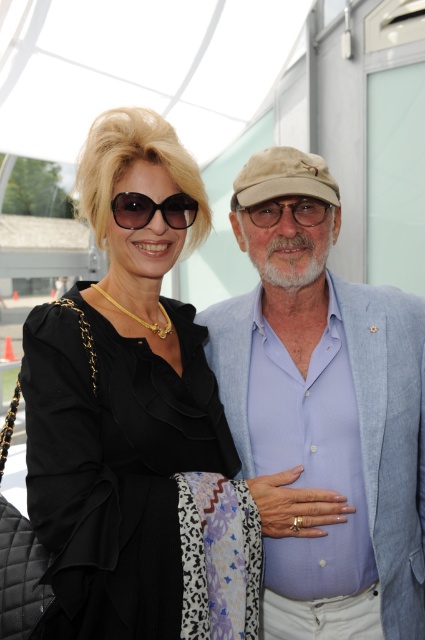
Can you confirm if black satin dress at center is positioned above light blue cotton shirt at center?

Correct, black satin dress at center is located above light blue cotton shirt at center.

Who is more distant from viewer, (102, 362) or (263, 266)?

The point (263, 266) is more distant.

This screenshot has width=425, height=640. What are the coordinates of `black satin dress at center` in the screenshot? It's located at (125, 410).

Is matte black sunglasses at upper left bigger than matte black glasses at center?

Yes, matte black sunglasses at upper left is bigger than matte black glasses at center.

Does matte black sunglasses at upper left appear on the right side of matte black glasses at center?

In fact, matte black sunglasses at upper left is to the left of matte black glasses at center.

The width and height of the screenshot is (425, 640). Describe the element at coordinates (153, 209) in the screenshot. I see `matte black sunglasses at upper left` at that location.

Where is `matte black sunglasses at upper left`? The width and height of the screenshot is (425, 640). matte black sunglasses at upper left is located at coordinates (153, 209).

Is light blue cotton shirt at center shorter than matte black sunglasses at upper left?

In fact, light blue cotton shirt at center may be taller than matte black sunglasses at upper left.

Where is `light blue cotton shirt at center`? light blue cotton shirt at center is located at coordinates (325, 412).

Between point (291, 192) and point (147, 216), which one is positioned in front?

Positioned in front is point (147, 216).

This screenshot has height=640, width=425. Identify the location of light blue cotton shirt at center. pyautogui.click(x=325, y=412).